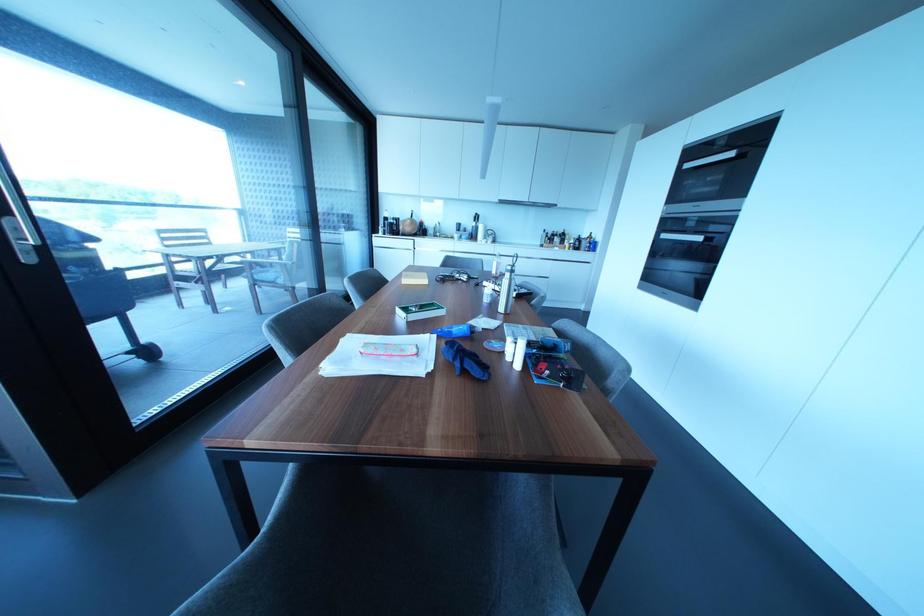
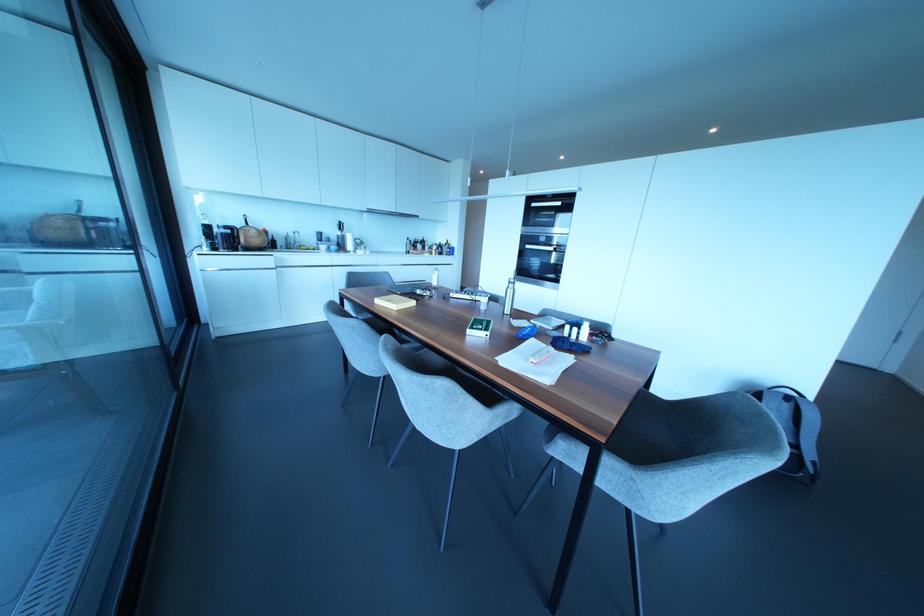
Question: I am providing you with two images of the same scene from different viewpoints. Please identify which objects are invisible in image2.

Choices:
 (A) small green box
 (B) gray chair sitting surface
 (C) gray backpack
 (D) none of these

Answer: (D)